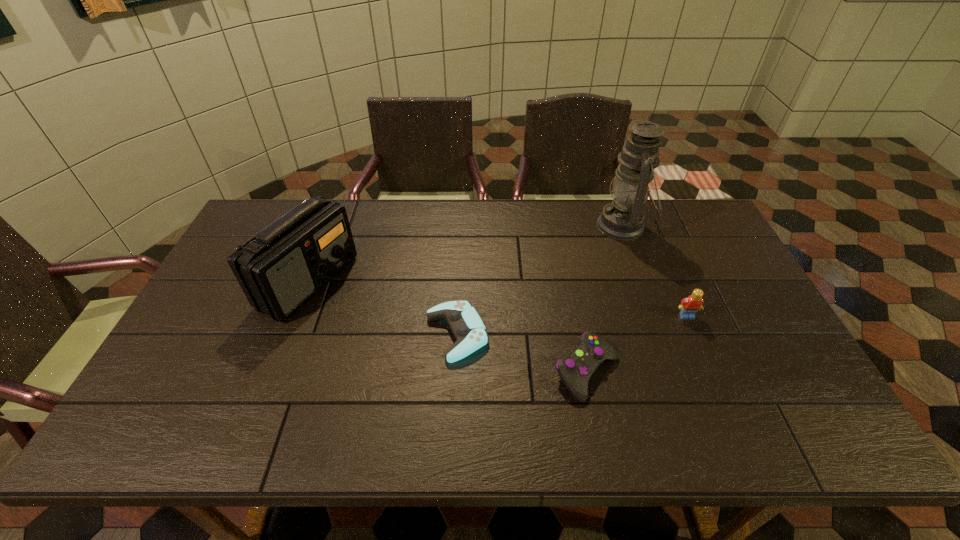
Locate an element on the screen. This screenshot has width=960, height=540. vacant region between the third tallest object and the left control is located at coordinates (572, 325).

The width and height of the screenshot is (960, 540). In order to click on free space between the oil lamp and the shorter control in this screenshot , I will do 540,280.

Where is `unoccupied area between the leftmost object and the Lego`? This screenshot has height=540, width=960. unoccupied area between the leftmost object and the Lego is located at coordinates pyautogui.click(x=497, y=299).

I want to click on blank region between the fourth object from right to left and the third shortest object, so click(x=572, y=325).

The width and height of the screenshot is (960, 540). Identify the location of empty space between the leftmost object and the Lego. [x=497, y=299].

Locate an element on the screen. The height and width of the screenshot is (540, 960). vacant space that's between the second object from left to right and the oil lamp is located at coordinates (540, 280).

Locate an element on the screen. Image resolution: width=960 pixels, height=540 pixels. free space between the fourth shortest object and the third object from right to left is located at coordinates pos(447,327).

I want to click on empty space between the Lego and the taller control, so click(636, 344).

At what (x,y) coordinates should I click in order to perform the action: click on free area in between the shorter control and the oil lamp. Please return your answer as a coordinate pair (x, y). Looking at the image, I should click on (540, 280).

Identify the location of object that stands as the closest to the tallest object. The width and height of the screenshot is (960, 540). (689, 306).